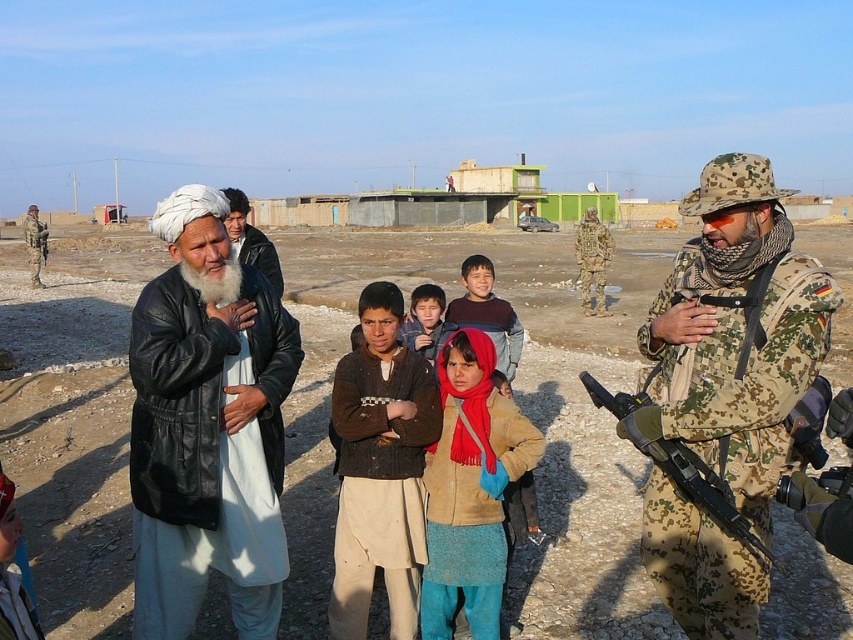
You are a photographer trying to capture a detailed shot of both the camouflage uniform at right and the camo fabric rifle at center. Given their sizes, which object should you focus on first to ensure it fits within your camera frame?

The camouflage uniform at right occupies less space than the camo fabric rifle at center, so you should focus on capturing the camo fabric rifle at center first since it is larger and requires more attention to fit properly.